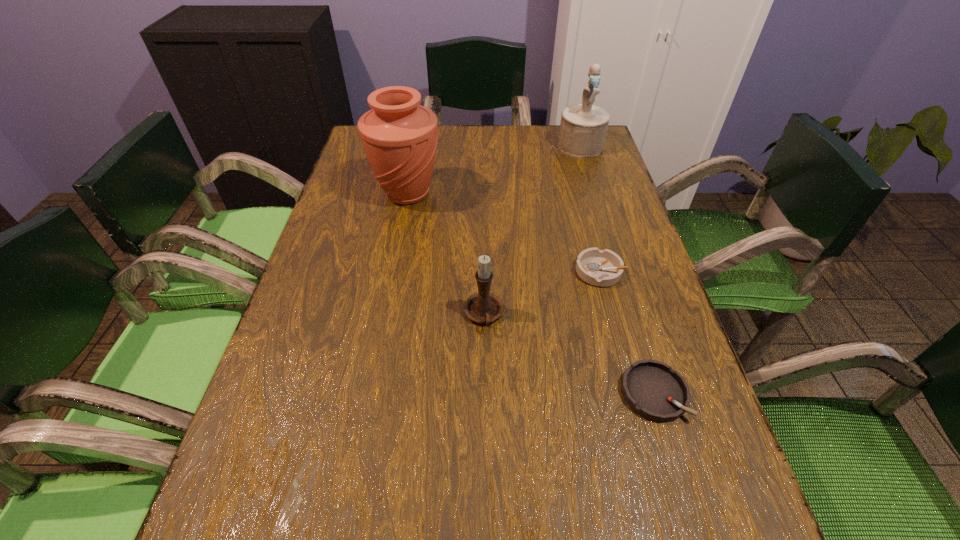
I want to click on vacant region located 0.350m on the left of the nearer ashtray, so click(424, 393).

The width and height of the screenshot is (960, 540). I want to click on free space located on the left of the farther ashtray, so click(517, 271).

What are the coordinates of `object present at the far edge` in the screenshot? It's located at (583, 127).

This screenshot has width=960, height=540. Find the location of `object that is at the left edge`. object that is at the left edge is located at coordinates (399, 136).

Where is `figurine that is positioned at the right edge`? Image resolution: width=960 pixels, height=540 pixels. figurine that is positioned at the right edge is located at coordinates (583, 127).

In order to click on object that is at the far right corner in this screenshot , I will do `click(583, 127)`.

This screenshot has height=540, width=960. I want to click on free space at the far edge of the desktop, so click(451, 130).

Where is `vacant space at the left edge of the desktop`? This screenshot has width=960, height=540. vacant space at the left edge of the desktop is located at coordinates (290, 313).

Identify the location of vacant space at the right edge. The width and height of the screenshot is (960, 540). (600, 354).

Identify the location of empty space that is in between the farther ashtray and the second farthest object. (504, 233).